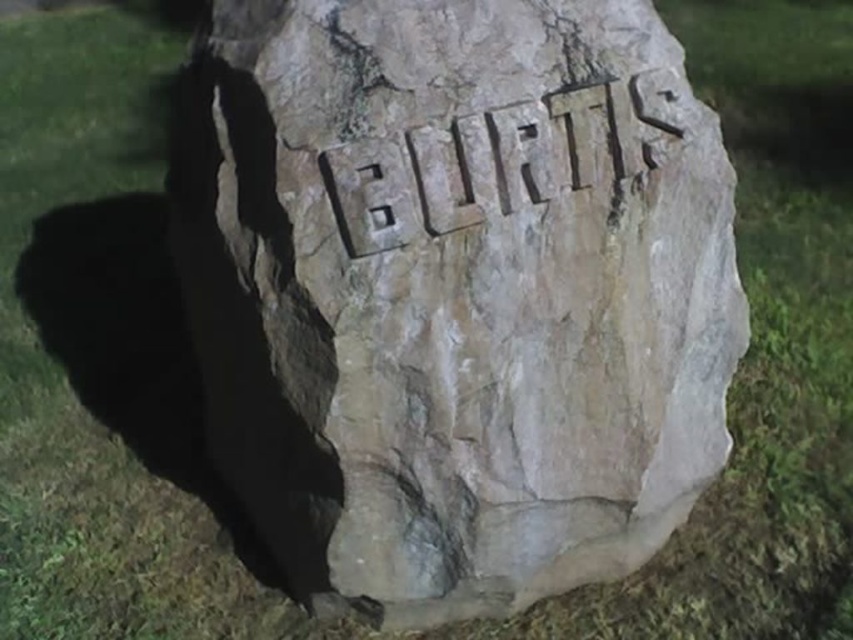
Question: Which object is farther from the camera taking this photo?

Choices:
 (A) carved stone name at center
 (B) brown rough stone at center

Answer: (B)

Question: Is brown rough stone at center above carved stone name at center?

Choices:
 (A) no
 (B) yes

Answer: (A)

Question: Does brown rough stone at center have a greater width compared to carved stone name at center?

Choices:
 (A) yes
 (B) no

Answer: (A)

Question: Is brown rough stone at center bigger than carved stone name at center?

Choices:
 (A) no
 (B) yes

Answer: (B)

Question: Which point appears farthest from the camera in this image?

Choices:
 (A) (637, 109)
 (B) (653, 317)

Answer: (B)

Question: Which object is farther from the camera taking this photo?

Choices:
 (A) brown rough stone at center
 (B) carved stone name at center

Answer: (A)